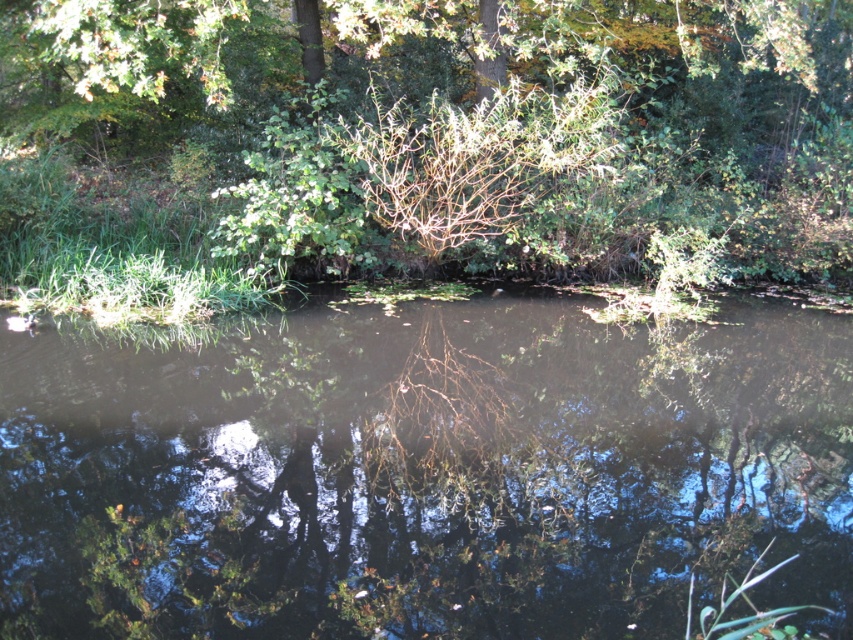
You are standing at the edge of the water and want to reach the green leafy bush at upper center. Which direction should you move to get closer to it without crossing the transparent water at center?

Since the transparent water at center is closer to you than the green leafy bush at upper center, you should move backward away from the water to get closer to the green leafy bush at upper center.

You are standing at the edge of the water and see the transparent water at center and the green leafy bush at upper center. Which object is closer to you?

The transparent water at center is closer to you because it is positioned under the green leafy bush at upper center, meaning it is lower in the scene and thus nearer to your viewpoint.